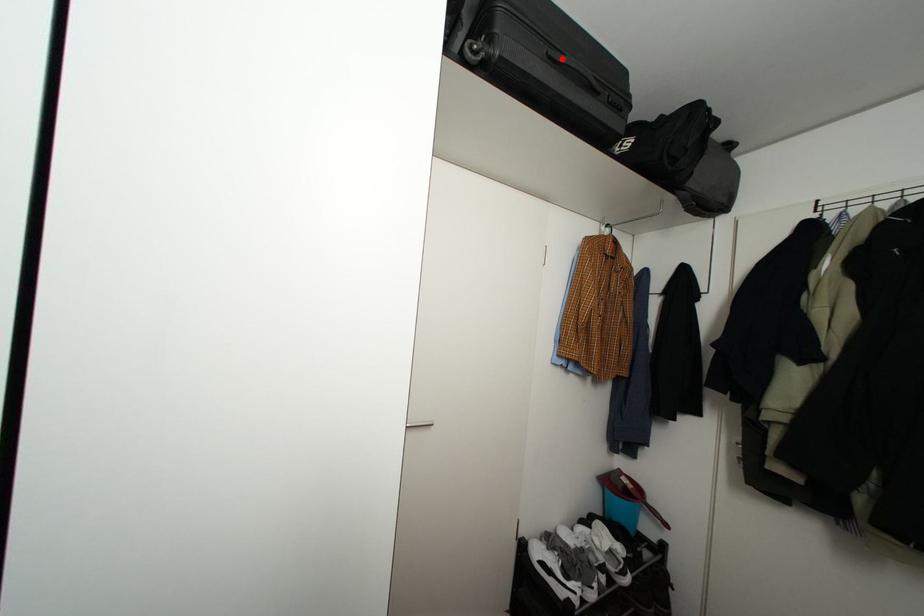
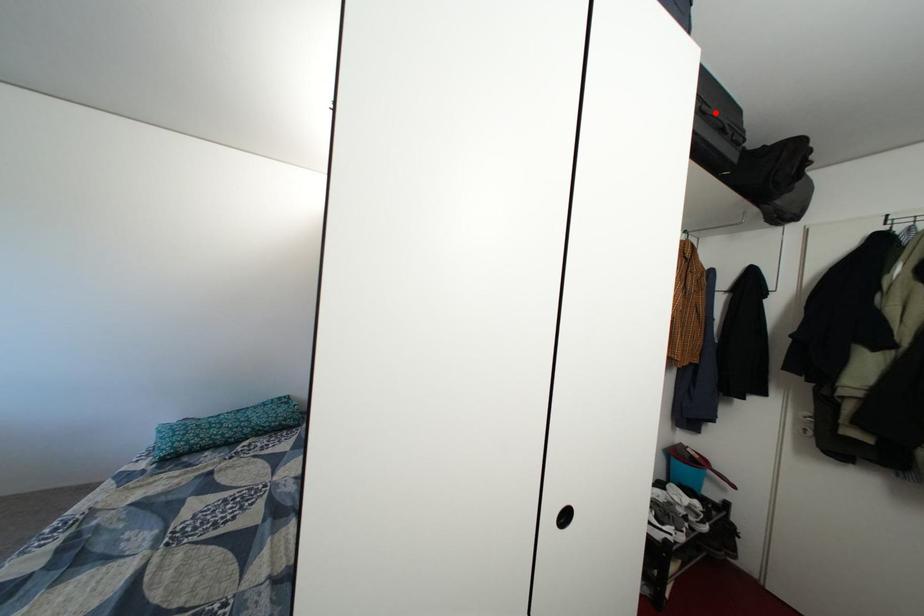
I am providing you with two images of the same scene from different viewpoints. A red point is marked on the first image and another point is marked on the second image. Does the point marked in image1 correspond to the same location as the one in image2?

Yes